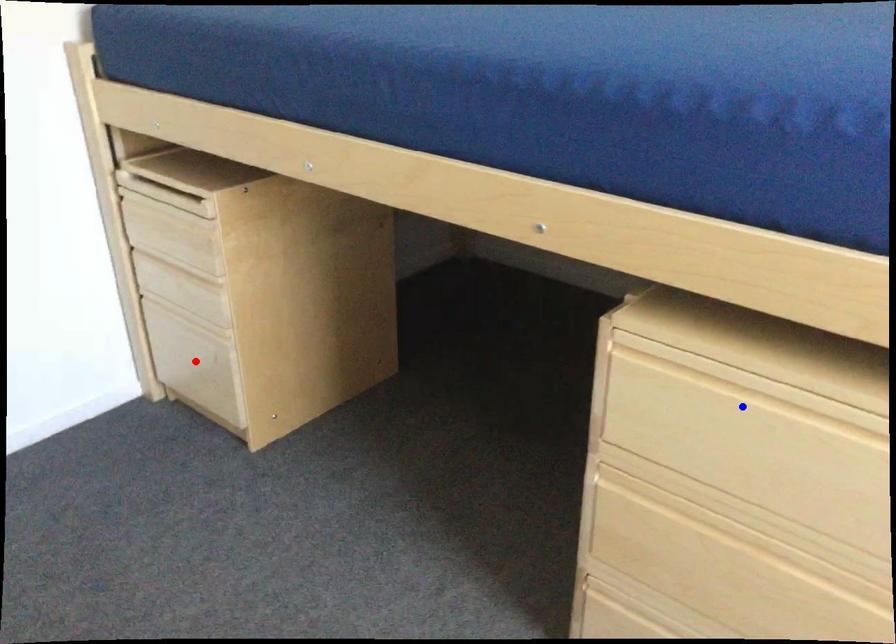
Question: Which of the two points in the image is closer to the camera?

Choices:
 (A) Blue point is closer.
 (B) Red point is closer.

Answer: (A)